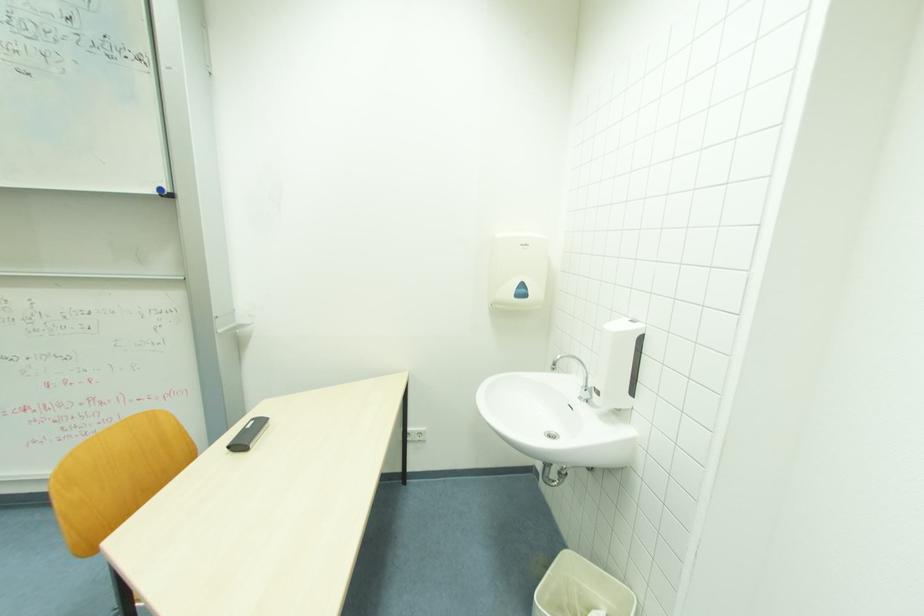
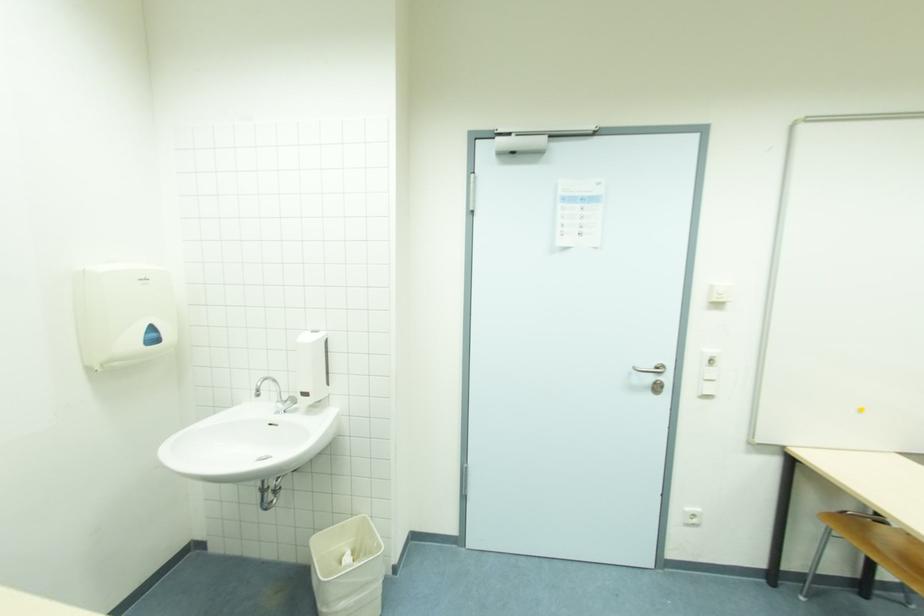
Question: The camera is either moving clockwise (left) or counter-clockwise (right) around the object. The first image is from the beginning of the video and the second image is from the end. Is the camera moving left or right when shooting the video?

Choices:
 (A) Left
 (B) Right

Answer: (A)